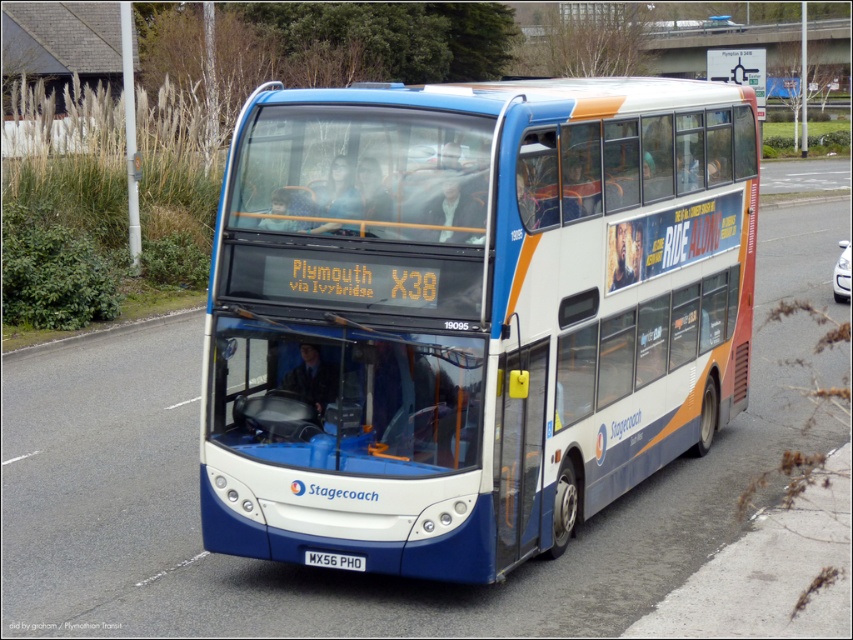
Question: Which point appears farthest from the camera in this image?

Choices:
 (A) (339, 557)
 (B) (277, 316)

Answer: (A)

Question: Can you confirm if white glossy bus at center is bigger than white metallic license plate at bottom?

Choices:
 (A) yes
 (B) no

Answer: (A)

Question: Can you confirm if white glossy bus at center is positioned below white metallic license plate at bottom?

Choices:
 (A) yes
 (B) no

Answer: (B)

Question: Does white glossy bus at center come behind white metallic license plate at bottom?

Choices:
 (A) no
 (B) yes

Answer: (A)